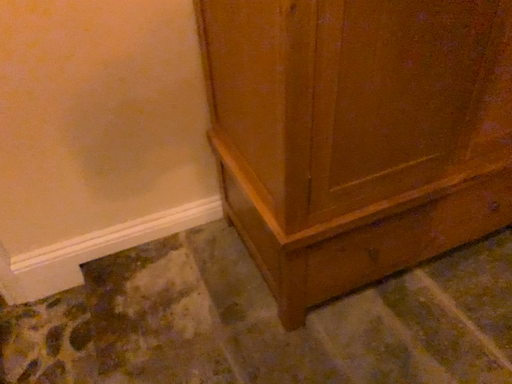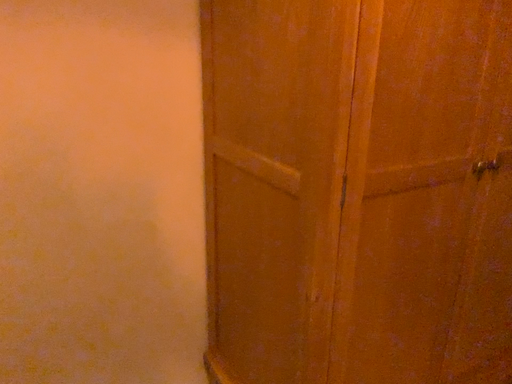
Question: How did the camera likely rotate when shooting the video?

Choices:
 (A) rotated left
 (B) rotated right

Answer: (B)